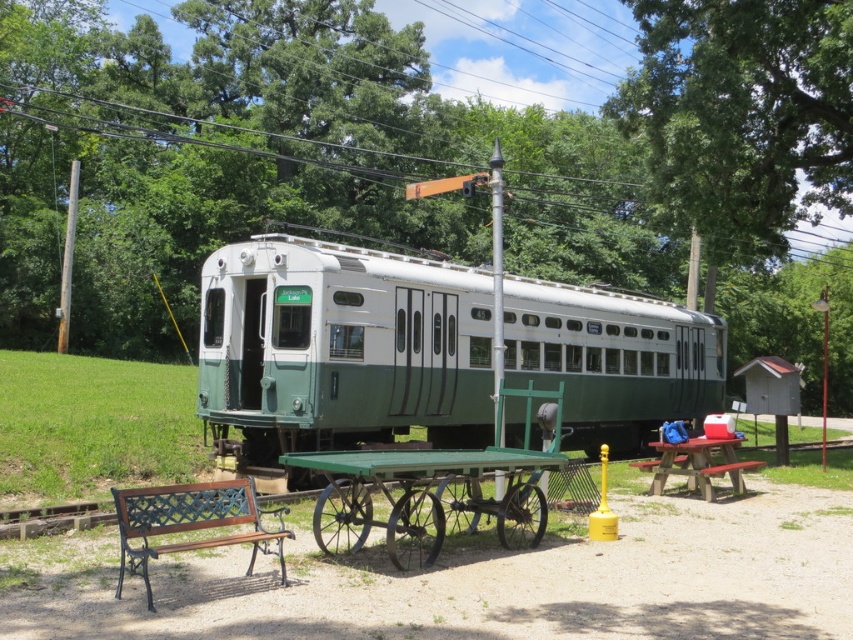
You are a visitor standing at the entrance of the heritage railway area and see the green matte train car at center and the brown wood bench at lower left. Which object is closer to your current position?

The brown wood bench at lower left is closer to your current position because it is positioned to the left side of the green matte train car at center, which is further away.

You are standing at the entrance of the train car and want to place a new item on the green metal cart at center. According to the coordinates provided, where should you walk to reach the cart?

The green metal cart at center is located at coordinates point (431,490), so you should walk towards that point to reach it.